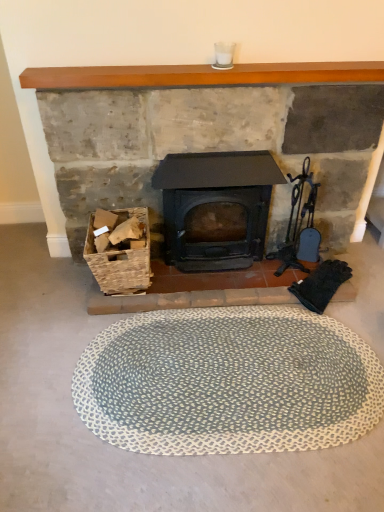
Question: Can you confirm if woven wood basket at lower left is positioned to the right of matte black wood burning stove at center?

Choices:
 (A) no
 (B) yes

Answer: (A)

Question: Is woven wood basket at lower left oriented towards matte black wood burning stove at center?

Choices:
 (A) no
 (B) yes

Answer: (A)

Question: Considering the relative sizes of woven wood basket at lower left and matte black wood burning stove at center in the image provided, is woven wood basket at lower left bigger than matte black wood burning stove at center?

Choices:
 (A) no
 (B) yes

Answer: (A)

Question: Is woven wood basket at lower left placed right next to matte black wood burning stove at center?

Choices:
 (A) yes
 (B) no

Answer: (B)

Question: Is matte black wood burning stove at center at the back of woven wood basket at lower left?

Choices:
 (A) yes
 (B) no

Answer: (B)

Question: From their relative heights in the image, would you say blue textured bath mat at center is taller or shorter than matte black stove at center?

Choices:
 (A) tall
 (B) short

Answer: (B)

Question: From the image's perspective, is blue textured bath mat at center positioned above or below matte black stove at center?

Choices:
 (A) above
 (B) below

Answer: (B)

Question: In the image, is blue textured bath mat at center positioned in front of or behind matte black stove at center?

Choices:
 (A) behind
 (B) front

Answer: (B)

Question: Visually, is blue textured bath mat at center positioned to the left or to the right of matte black stove at center?

Choices:
 (A) right
 (B) left

Answer: (A)

Question: From the image's perspective, is blue textured bath mat at center positioned above or below woven wood basket at lower left?

Choices:
 (A) below
 (B) above

Answer: (A)

Question: Is point (125, 323) positioned closer to the camera than point (110, 251)?

Choices:
 (A) farther
 (B) closer

Answer: (A)

Question: Would you say blue textured bath mat at center is to the left or to the right of woven wood basket at lower left in the picture?

Choices:
 (A) left
 (B) right

Answer: (B)

Question: Based on their sizes in the image, would you say blue textured bath mat at center is bigger or smaller than woven wood basket at lower left?

Choices:
 (A) small
 (B) big

Answer: (A)

Question: Is matte black stove at center taller or shorter than matte black wood burning stove at center?

Choices:
 (A) tall
 (B) short

Answer: (A)

Question: Considering the positions of point (61, 84) and point (279, 181), is point (61, 84) closer or farther from the camera than point (279, 181)?

Choices:
 (A) closer
 (B) farther

Answer: (A)